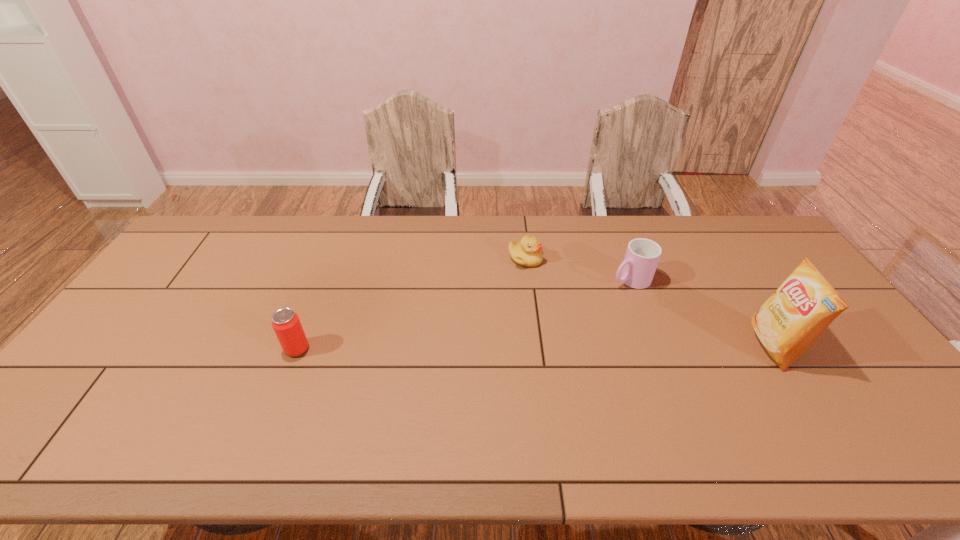
In order to click on the third closest object relative to the shortest object in this screenshot , I will do `click(286, 324)`.

Locate which object is the closest to the tallest object. Please provide its 2D coordinates. Your answer should be formatted as a tuple, i.e. [(x, y)], where the tuple contains the x and y coordinates of a point satisfying the conditions above.

[(637, 270)]

This screenshot has height=540, width=960. I want to click on free space that satisfies the following two spatial constraints: 1. on the front side of the tallest object; 2. on the front-facing side of the duckling, so click(536, 346).

Where is `free spot that satisfies the following two spatial constraints: 1. on the front side of the duckling; 2. on the front-facing side of the tallest object`? The width and height of the screenshot is (960, 540). free spot that satisfies the following two spatial constraints: 1. on the front side of the duckling; 2. on the front-facing side of the tallest object is located at coordinates (536, 346).

Locate an element on the screen. The width and height of the screenshot is (960, 540). vacant space that satisfies the following two spatial constraints: 1. on the front side of the third object from right to left; 2. on the left side of the cup is located at coordinates (528, 280).